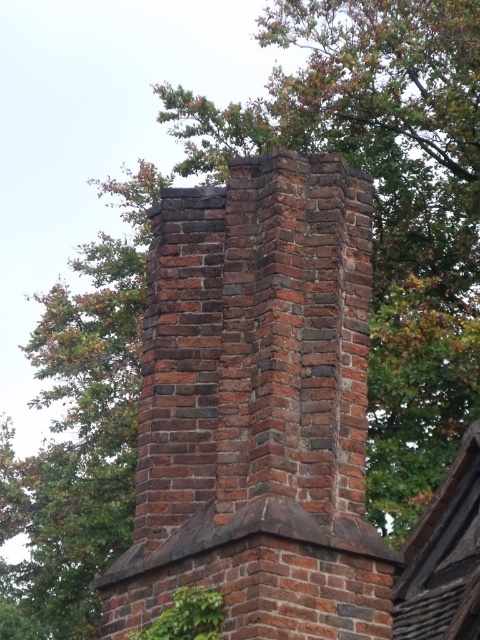
Question: In this image, where is red brick chimney at center located relative to brown shingles at upper center?

Choices:
 (A) left
 (B) right

Answer: (A)

Question: Considering the real-world distances, which object is farthest from the green leafy ivy at lower center?

Choices:
 (A) red brick chimney at center
 (B) brown shingles at upper center

Answer: (B)

Question: Among these objects, which one is farthest from the camera?

Choices:
 (A) red brick chimney at center
 (B) green leafy ivy at lower center
 (C) brown shingles at upper center

Answer: (C)

Question: Is red brick chimney at center closer to camera compared to green leafy ivy at lower center?

Choices:
 (A) yes
 (B) no

Answer: (A)

Question: Which point appears closest to the camera in this image?

Choices:
 (A) (187, 593)
 (B) (328, 324)
 (C) (430, 636)

Answer: (A)

Question: In this image, where is red brick chimney at center located relative to brown shingles at upper center?

Choices:
 (A) right
 (B) left

Answer: (B)